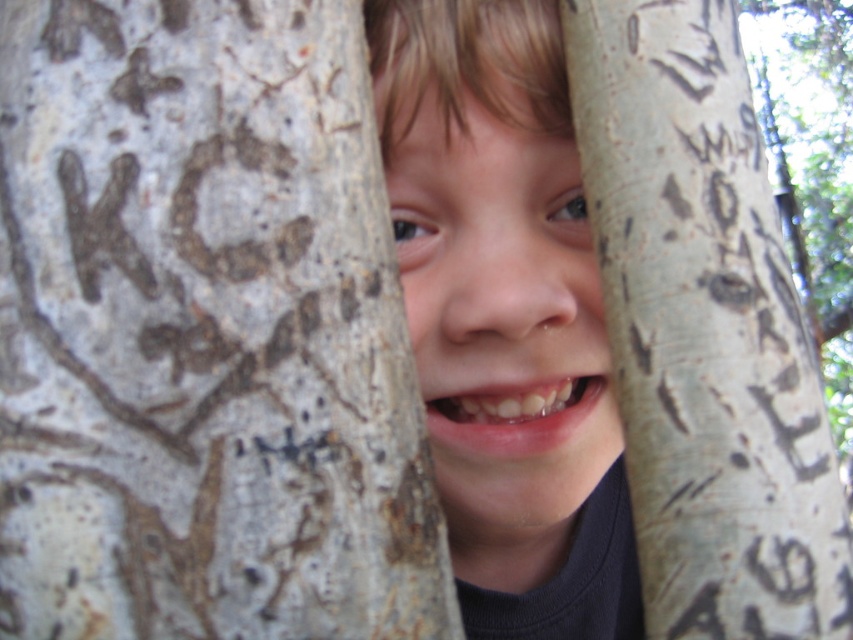
Is point (30, 284) closer to viewer compared to point (711, 598)?

Yes.

I want to click on white bark tree trunk at center, so click(x=202, y=332).

Is light gray bark tree at center above smooth skin face at center?

Yes, light gray bark tree at center is above smooth skin face at center.

The height and width of the screenshot is (640, 853). What are the coordinates of `light gray bark tree at center` in the screenshot? It's located at (704, 330).

The height and width of the screenshot is (640, 853). I want to click on light gray bark tree at center, so click(704, 330).

Between white bark tree trunk at center and smooth skin face at center, which one appears on the right side from the viewer's perspective?

smooth skin face at center

Which of these two, white bark tree trunk at center or smooth skin face at center, stands taller?

smooth skin face at center is taller.

The height and width of the screenshot is (640, 853). What are the coordinates of `white bark tree trunk at center` in the screenshot? It's located at (202, 332).

The width and height of the screenshot is (853, 640). What are the coordinates of `white bark tree trunk at center` in the screenshot? It's located at (202, 332).